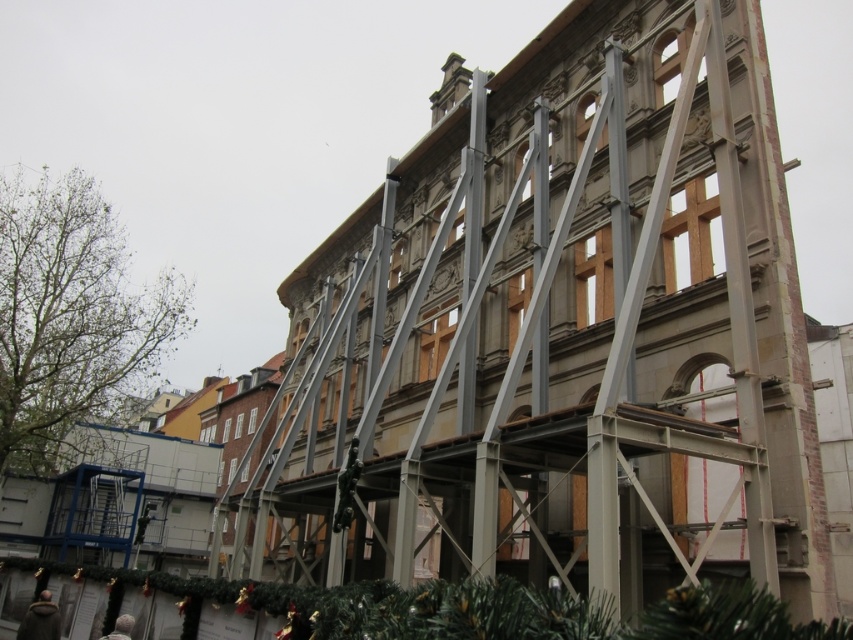
Is dark gray coat at lower center taller than dark gray fabric at lower left?

Yes, dark gray coat at lower center is taller than dark gray fabric at lower left.

Can you confirm if dark gray coat at lower center is smaller than dark gray fabric at lower left?

Actually, dark gray coat at lower center might be larger than dark gray fabric at lower left.

Where is `dark gray coat at lower center`? dark gray coat at lower center is located at coordinates (39, 620).